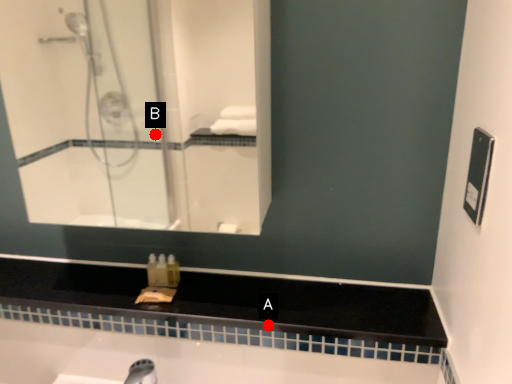
Question: Two points are circled on the image, labeled by A and B beside each circle. Which point is closer to the camera?

Choices:
 (A) A is closer
 (B) B is closer

Answer: (A)